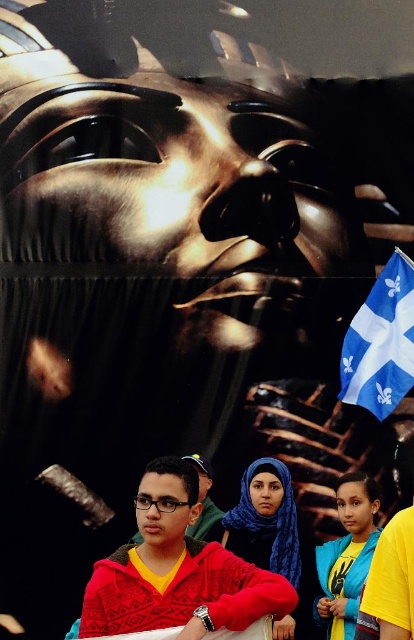
Question: Can you confirm if blue fabric hijab at lower center is wider than matte red hoodie at lower left?

Choices:
 (A) no
 (B) yes

Answer: (A)

Question: Among these objects, which one is nearest to the camera?

Choices:
 (A) blue fabric hijab at center
 (B) blue fabric flag at lower right
 (C) blue fabric hijab at lower center
 (D) matte red hoodie at lower left

Answer: (A)

Question: Which is farther from the matte red hoodie at lower left?

Choices:
 (A) blue fabric hijab at lower center
 (B) blue fabric flag at lower right
 (C) red sweater at lower left

Answer: (B)

Question: Does red sweater at lower left appear over matte red hoodie at lower left?

Choices:
 (A) no
 (B) yes

Answer: (A)

Question: Does red sweater at lower left lie in front of blue fabric hijab at center?

Choices:
 (A) no
 (B) yes

Answer: (B)

Question: Considering the real-world distances, which object is farthest from the matte red hoodie at lower left?

Choices:
 (A) blue fabric flag at lower right
 (B) blue fabric hijab at lower center
 (C) blue fabric hijab at center

Answer: (A)